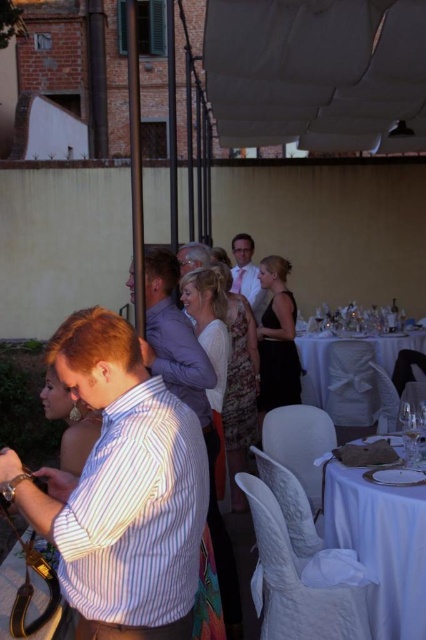
You are a photographer at the wedding reception. You want to take a photo that includes both the point at (308, 348) and the point at (406, 448). Which point is closer to the camera?

The point at (308, 348) is closer to the camera than the point at (406, 448).

You are a server at the wedding reception and need to place a dessert plate on the table. The dessert plate has a diameter of 25 cm. Can the clear glass wine glass at center be placed on the white satin tablecloth at lower right without falling off?

The white satin tablecloth at lower right is wider than the clear glass wine glass at center, so yes, the wine glass can be placed on the tablecloth without falling off.